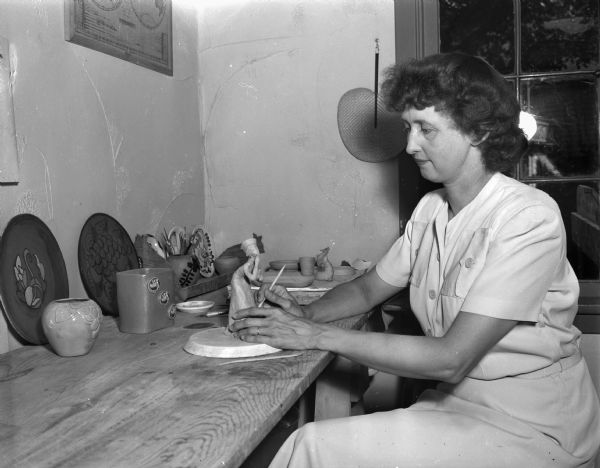
Where is `glare on window`? glare on window is located at coordinates (527, 120).